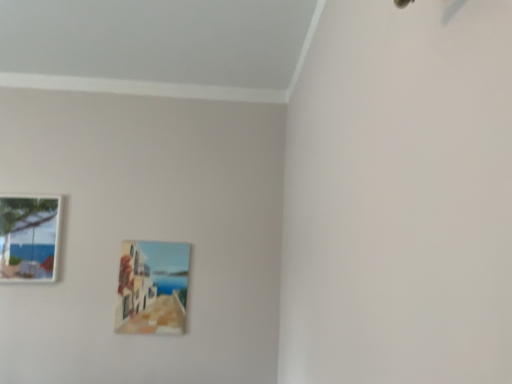
Question: Is matte wooden picture frame at center, which is the 2th picture frame from left to right, shorter than wooden picture frame at lower left, the second picture frame when ordered from right to left?

Choices:
 (A) no
 (B) yes

Answer: (A)

Question: Would you say wooden picture frame at lower left, the 1th picture frame when ordered from left to right, is part of matte wooden picture frame at center, which is the 2th picture frame from left to right,'s contents?

Choices:
 (A) yes
 (B) no

Answer: (B)

Question: Is matte wooden picture frame at center, which is the 2th picture frame from left to right, positioned with its back to wooden picture frame at lower left, the 1th picture frame when ordered from left to right?

Choices:
 (A) no
 (B) yes

Answer: (A)

Question: Does matte wooden picture frame at center, which is the 2th picture frame from left to right, have a lesser width compared to wooden picture frame at lower left, the 1th picture frame when ordered from left to right?

Choices:
 (A) yes
 (B) no

Answer: (A)

Question: Does matte wooden picture frame at center, which is the 2th picture frame from left to right, have a smaller size compared to wooden picture frame at lower left, the 1th picture frame when ordered from left to right?

Choices:
 (A) yes
 (B) no

Answer: (A)

Question: Does matte wooden picture frame at center, which is the 2th picture frame from left to right, lie in front of wooden picture frame at lower left, the second picture frame when ordered from right to left?

Choices:
 (A) no
 (B) yes

Answer: (A)

Question: Does wooden picture frame at lower left, the second picture frame when ordered from right to left, have a lesser height compared to matte wooden picture frame at center, marked as the first picture frame in a right-to-left arrangement?

Choices:
 (A) no
 (B) yes

Answer: (B)

Question: Can you confirm if wooden picture frame at lower left, the second picture frame when ordered from right to left, is wider than matte wooden picture frame at center, marked as the first picture frame in a right-to-left arrangement?

Choices:
 (A) yes
 (B) no

Answer: (A)

Question: Is wooden picture frame at lower left, the 1th picture frame when ordered from left to right, positioned in front of matte wooden picture frame at center, which is the 2th picture frame from left to right?

Choices:
 (A) no
 (B) yes

Answer: (B)

Question: Can we say wooden picture frame at lower left, the second picture frame when ordered from right to left, lies outside matte wooden picture frame at center, marked as the first picture frame in a right-to-left arrangement?

Choices:
 (A) no
 (B) yes

Answer: (B)

Question: Can you confirm if wooden picture frame at lower left, the second picture frame when ordered from right to left, is positioned to the left of matte wooden picture frame at center, which is the 2th picture frame from left to right?

Choices:
 (A) yes
 (B) no

Answer: (A)

Question: Are wooden picture frame at lower left, the 1th picture frame when ordered from left to right, and matte wooden picture frame at center, marked as the first picture frame in a right-to-left arrangement, making contact?

Choices:
 (A) yes
 (B) no

Answer: (B)

Question: Is wooden picture frame at lower left, the second picture frame when ordered from right to left, situated inside matte wooden picture frame at center, which is the 2th picture frame from left to right, or outside?

Choices:
 (A) inside
 (B) outside

Answer: (B)